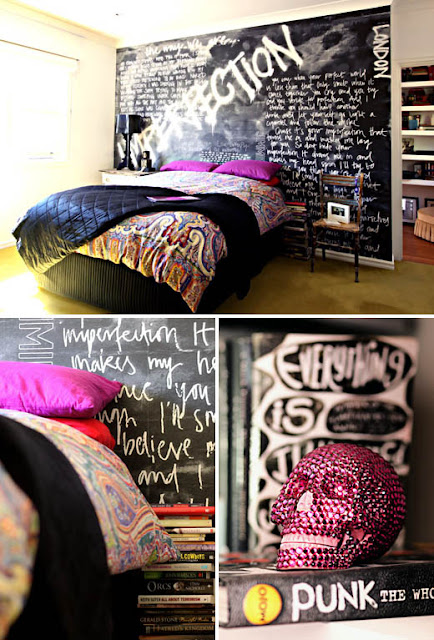
Where is `white painted walls`? The height and width of the screenshot is (640, 434). white painted walls is located at coordinates (92, 77), (419, 38).